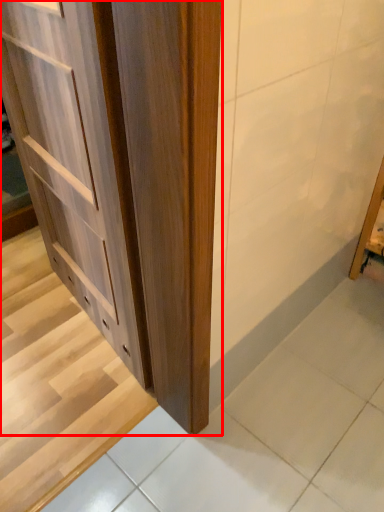
Question: Where is cupboard (annotated by the red box) located in relation to stairwell in the image?

Choices:
 (A) right
 (B) left

Answer: (A)